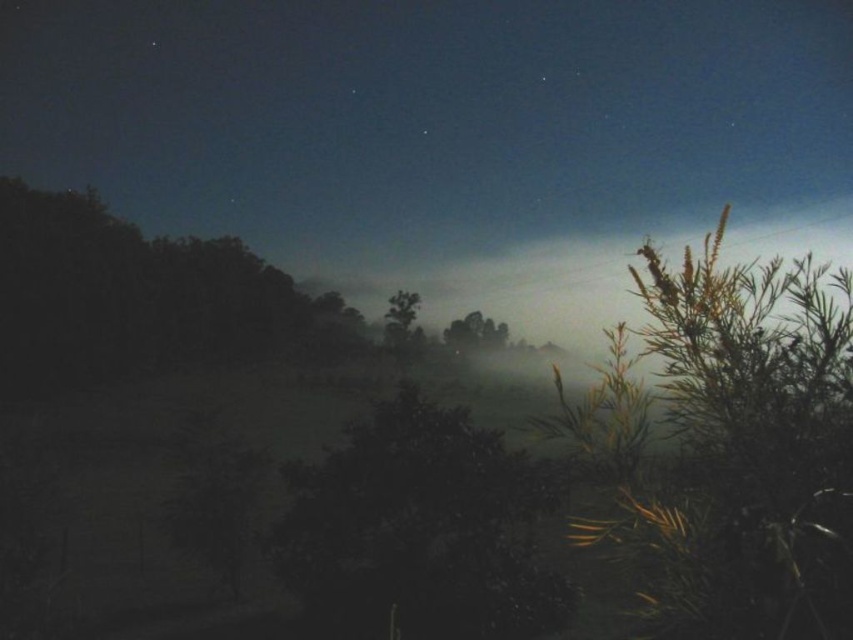
Is green leafy plant at right smaller than green matte tree at center?

No, green leafy plant at right is not smaller than green matte tree at center.

Between green leafy plant at right and green matte tree at center, which one is positioned lower?

green matte tree at center is below.

Where is `green leafy plant at right`? green leafy plant at right is located at coordinates tap(732, 449).

Between green matte tree at center and translucent foggy tree at center, which one has less height?

green matte tree at center is shorter.

Is green matte tree at center wider than translucent foggy tree at center?

Incorrect, green matte tree at center's width does not surpass translucent foggy tree at center's.

Which is in front, point (503, 486) or point (469, 330)?

Positioned in front is point (503, 486).

Identify the location of green matte tree at center. (419, 529).

Looking at this image, can you confirm if green matte tree at center is positioned above green leafy tree at center?

No, green matte tree at center is not above green leafy tree at center.

Who is more forward, [444,445] or [399,321]?

Positioned in front is point [444,445].

The height and width of the screenshot is (640, 853). Identify the location of green matte tree at center. (419, 529).